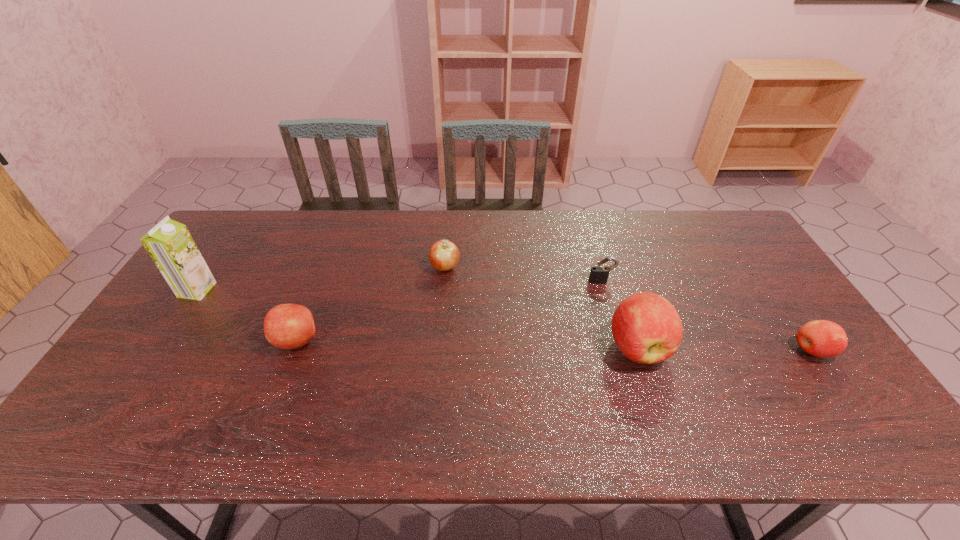
In the image, there is a desktop. At what (x,y) coordinates should I click in order to perform the action: click on vacant space at the left edge. Please return your answer as a coordinate pair (x, y). Looking at the image, I should click on (218, 294).

This screenshot has height=540, width=960. I want to click on vacant space at the right edge, so click(731, 254).

Identify the location of free point at the far left corner. (228, 234).

I want to click on free space at the near left corner, so click(172, 382).

You are a GUI agent. You are given a task and a screenshot of the screen. Output one action in this format:
    pyautogui.click(x=<x>, y=<y>)
    Task: Click on the vacant space at the far right corner of the desktop
    The image size is (960, 540).
    Given the screenshot: What is the action you would take?
    coord(751,252)

At what (x,y) coordinates should I click in order to perform the action: click on empty space that is in between the third tallest object and the padlock. Please return your answer as a coordinate pair (x, y). Looking at the image, I should click on (449, 311).

Where is `free space between the rightmost apple and the tallest apple`? The image size is (960, 540). free space between the rightmost apple and the tallest apple is located at coordinates (725, 349).

This screenshot has width=960, height=540. I want to click on free space between the tallest apple and the rightmost object, so click(725, 349).

You are a GUI agent. You are given a task and a screenshot of the screen. Output one action in this format:
    pyautogui.click(x=<x>, y=<y>)
    Task: Click on the unoccupied position between the tallest apple and the second tallest apple
    
    Given the screenshot: What is the action you would take?
    pyautogui.click(x=468, y=344)

Where is `vacant area that lies between the fifth shortest object and the third shortest apple`? This screenshot has height=540, width=960. vacant area that lies between the fifth shortest object and the third shortest apple is located at coordinates (468, 344).